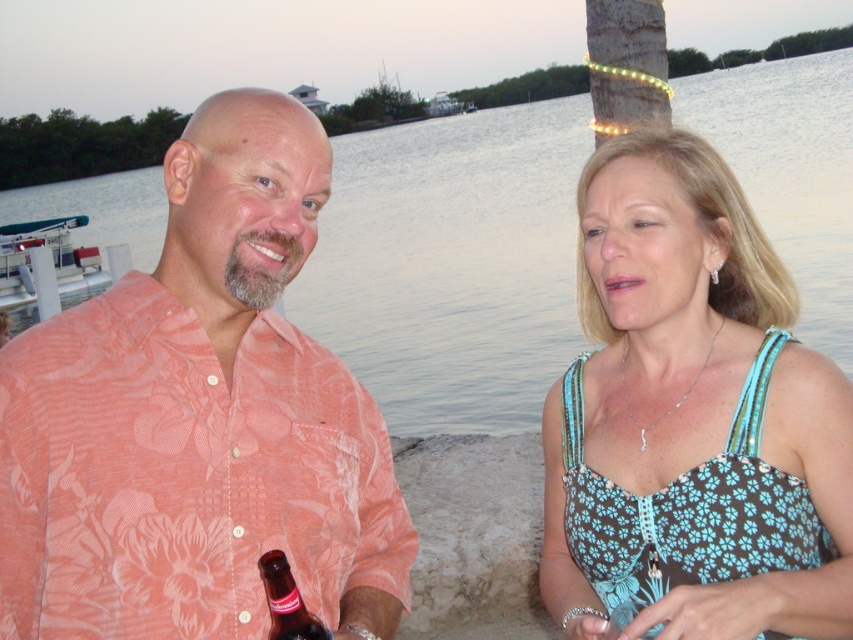
In the scene shown: Does pink floral shirt at left have a lesser height compared to blue floral fabric dress at upper right?

Yes, pink floral shirt at left is shorter than blue floral fabric dress at upper right.

Is pink floral shirt at left wider than blue floral fabric dress at upper right?

Correct, the width of pink floral shirt at left exceeds that of blue floral fabric dress at upper right.

The height and width of the screenshot is (640, 853). In order to click on pink floral shirt at left in this screenshot , I will do `click(199, 419)`.

Between blue floral fabric dress at upper right and brown glass bottle at lower left, which one appears on the left side from the viewer's perspective?

From the viewer's perspective, brown glass bottle at lower left appears more on the left side.

The image size is (853, 640). Describe the element at coordinates (691, 417) in the screenshot. I see `blue floral fabric dress at upper right` at that location.

Between point (834, 365) and point (283, 592), which one is positioned behind?

Point (834, 365)

Image resolution: width=853 pixels, height=640 pixels. In order to click on blue floral fabric dress at upper right in this screenshot , I will do `click(691, 417)`.

Which of these two, pink floral shirt at left or clear water at center, stands taller?

Standing taller between the two is clear water at center.

Who is positioned more to the left, pink floral shirt at left or clear water at center?

From the viewer's perspective, pink floral shirt at left appears more on the left side.

Is point (189, 593) closer to viewer compared to point (799, 83)?

That is True.

At what (x,y) coordinates should I click in order to perform the action: click on pink floral shirt at left. Please return your answer as a coordinate pair (x, y). Looking at the image, I should click on (199, 419).